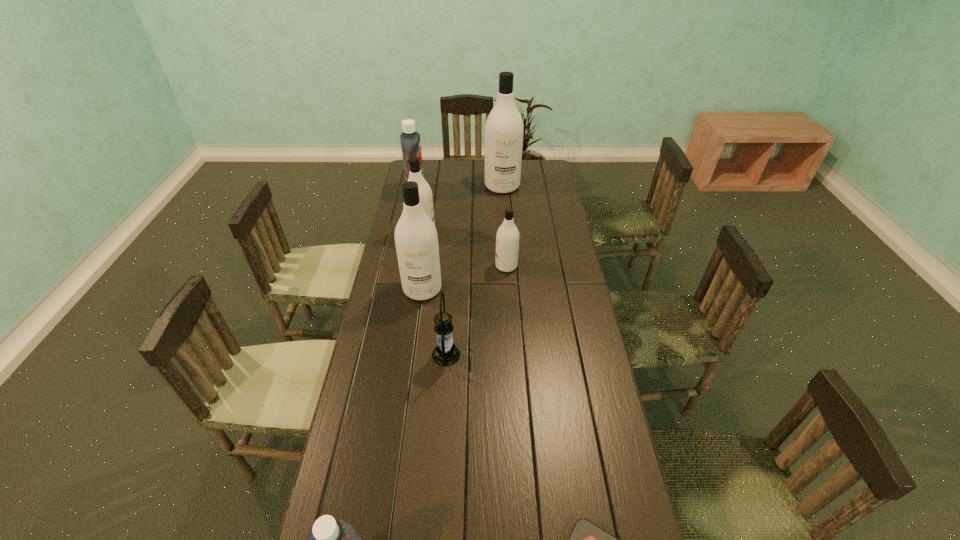
Identify the location of the second nearest white shampoo. click(x=507, y=238).

The height and width of the screenshot is (540, 960). I want to click on vacant region located 0.100m on the front-facing side of the farthest white shampoo, so click(504, 208).

Locate an element on the screen. vacant region located on the front-facing side of the fifth farthest object is located at coordinates (417, 328).

Find the location of a particular element. vacant position located on the front label of the farther blue shampoo is located at coordinates (458, 193).

Find the location of a particular element. The image size is (960, 540). vacant area located 0.240m on the front-facing side of the third biggest white shampoo is located at coordinates (492, 234).

Locate an element on the screen. vacant space located 0.230m on the side where the sixth farthest object emits light is located at coordinates (531, 355).

Where is `free region located on the front-facing side of the fourth farthest shampoo`? free region located on the front-facing side of the fourth farthest shampoo is located at coordinates (435, 266).

At what (x,y) coordinates should I click in order to perform the action: click on vacant area located 0.260m on the front-facing side of the fourth farthest shampoo. Please return your answer as a coordinate pair (x, y). Looking at the image, I should click on (430, 266).

Where is `free region located 0.140m on the front-facing side of the fourth farthest shampoo`? free region located 0.140m on the front-facing side of the fourth farthest shampoo is located at coordinates (460, 266).

Identify the location of object that is positioned at the far edge. (504, 127).